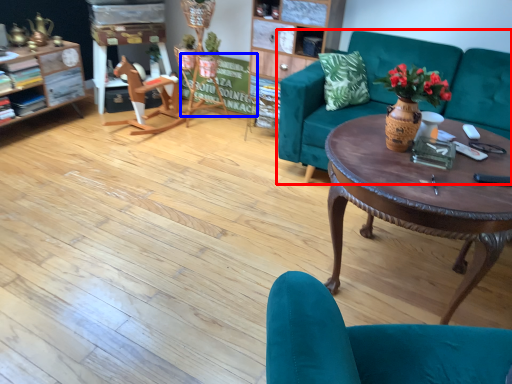
Question: Which object appears closest to the camera in this image, studio couch (highlighted by a red box) or bulletin board (highlighted by a blue box)?

Choices:
 (A) studio couch
 (B) bulletin board

Answer: (A)